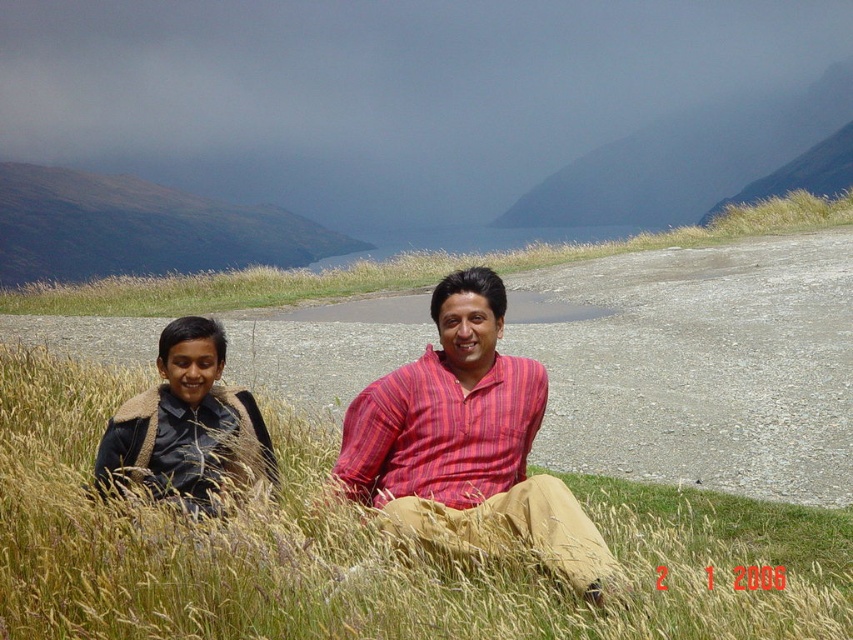
You are a photographer trying to capture both the smooth grassy hillside at upper center and the black leather jacket at left in the same frame. Based on their positions, can you determine which object is closer to the camera?

The black leather jacket at left is behind the smooth grassy hillside at upper center, so the smooth grassy hillside at upper center is closer to the camera than the black leather jacket at left.